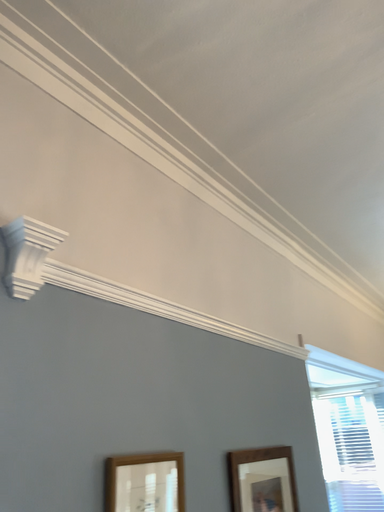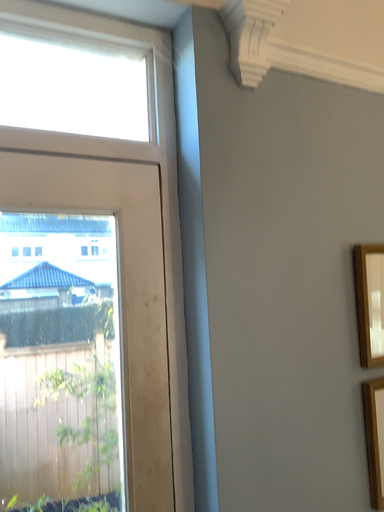
Question: How did the camera likely rotate when shooting the video?

Choices:
 (A) rotated upward
 (B) rotated downward

Answer: (B)